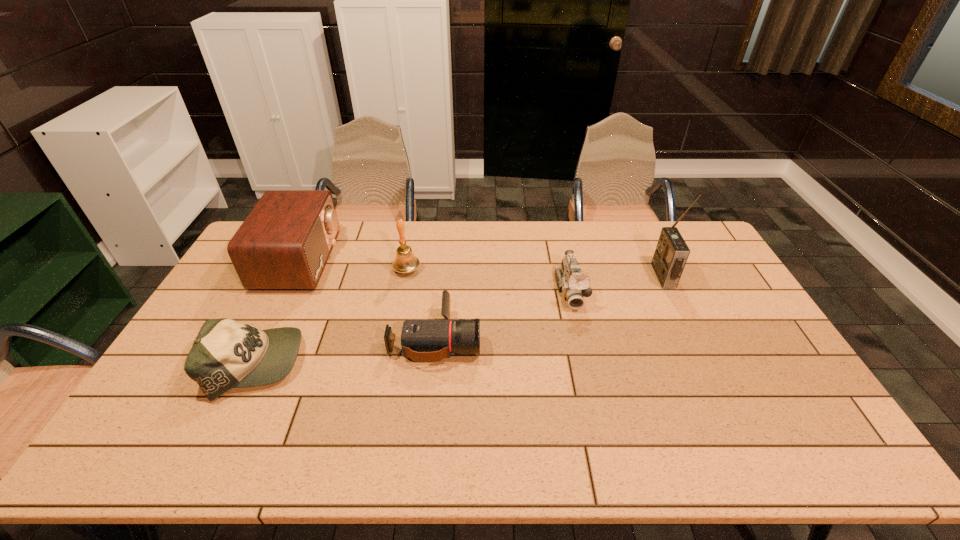
Locate an element on the screen. free space located 0.140m on the display of the taller radio receiver is located at coordinates (614, 276).

You are a GUI agent. You are given a task and a screenshot of the screen. Output one action in this format:
    pyautogui.click(x=<x>, y=<y>)
    Task: Click on the vacant area located 0.180m on the back of the bell
    This screenshot has height=540, width=960.
    Given the screenshot: What is the action you would take?
    pyautogui.click(x=414, y=232)

Locate an element on the screen. vacant space located on the front panel of the left radio receiver is located at coordinates (444, 260).

Identify the location of free space located 0.290m on the front-facing side of the taller camcorder. This screenshot has width=960, height=540. (594, 392).

The width and height of the screenshot is (960, 540). I want to click on vacant space located on the front-facing side of the baseball cap, so click(x=396, y=364).

The image size is (960, 540). In order to click on vacant region located 0.380m on the lens of the left camcorder in this screenshot , I will do `click(610, 338)`.

Locate an element on the screen. object located in the far edge section of the desktop is located at coordinates (284, 243).

This screenshot has width=960, height=540. Identify the location of radio receiver situated at the left edge. (284, 243).

What are the coordinates of `baseball cap that is at the left edge` in the screenshot? It's located at (226, 354).

At what (x,y) coordinates should I click in order to perform the action: click on object at the far left corner. Please return your answer as a coordinate pair (x, y). Looking at the image, I should click on (284, 243).